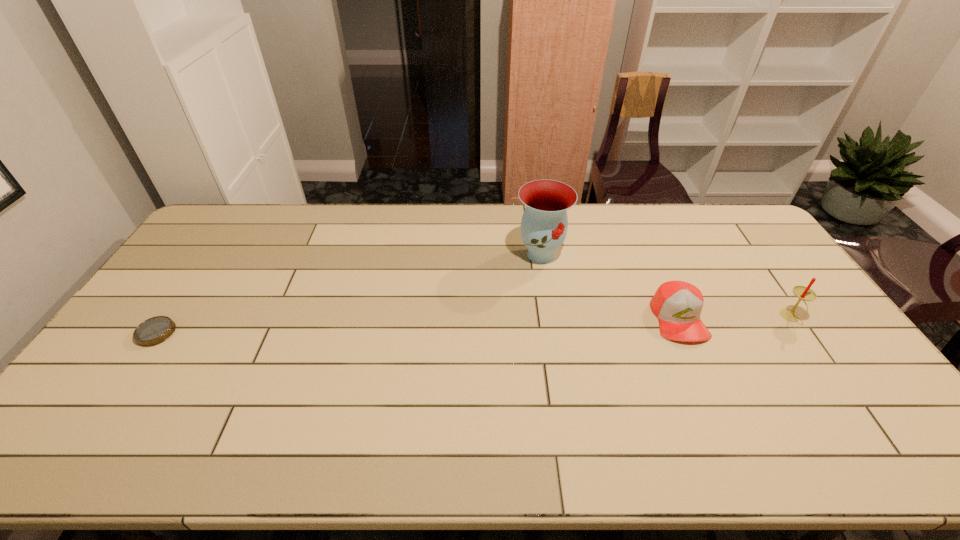
At what (x,y) coordinates should I click in order to perform the action: click on the third object from right to left. Please return your answer as a coordinate pair (x, y). This screenshot has width=960, height=540. Looking at the image, I should click on (544, 224).

The width and height of the screenshot is (960, 540). Identify the location of vase. (544, 224).

The image size is (960, 540). Identify the location of the rightmost object. (803, 293).

What are the coordinates of `candle` in the screenshot? It's located at pyautogui.click(x=803, y=293).

Find the location of a particular element. the second shortest object is located at coordinates (677, 304).

What are the coordinates of `baseball cap` in the screenshot? It's located at (677, 304).

Identify the location of the shortest object. The width and height of the screenshot is (960, 540). (153, 331).

This screenshot has width=960, height=540. In order to click on the leftmost object in this screenshot , I will do `click(153, 331)`.

Identify the location of vacant point located 0.070m on the back of the second object from left to right. The width and height of the screenshot is (960, 540). (537, 227).

Identify the location of free space located on the front of the candle. This screenshot has width=960, height=540. (855, 410).